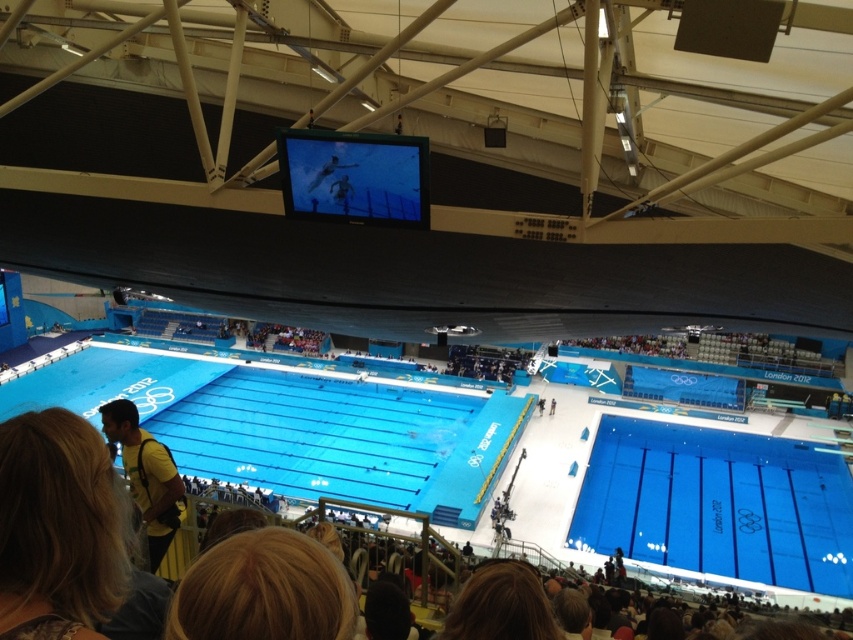
You are a spectator sitting in the stands and want to take a photo of the blue smooth pool at lower right. Based on its position, where should you aim your camera to capture it?

The blue smooth pool at lower right is located at coordinates point (718, 502), so aim your camera towards that position to capture it.

You are a swimmer preparing to dive into the blue smooth pool at lower right. From your position at the edge of the pool, you notice a person with brown hair at lower center. Can you safely dive without hitting their hair?

The blue smooth pool at lower right is shorter than the brown hair at lower center, meaning the hair is closer to the water surface. This creates a risk of collision, so you should adjust your dive path or wait for clearance to avoid hitting the brown hair at lower center.

You are a swimmer preparing for a race and notice the blue smooth pool at lower right and the brown hair at lower center in your line of sight. Which object appears wider from your position?

The brown hair at lower center appears wider because the blue smooth pool at lower right has a smaller width compared to it.